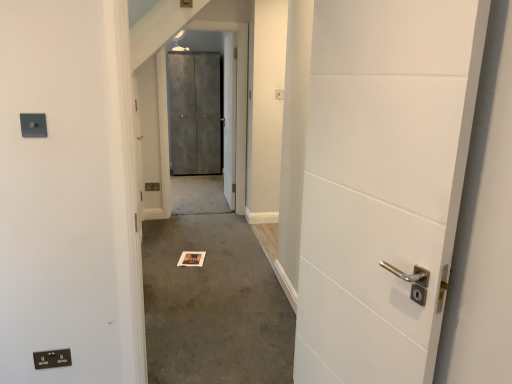
Locate an element on the screen. metallic gray elevator door at center is located at coordinates (234, 131).

At what (x,y) coordinates should I click in order to perform the action: click on matte gray electric outlet at upper left, the 1th electric outlet positioned from the front. Please return your answer as a coordinate pair (x, y). Looking at the image, I should click on point(33,125).

Where is `carpeted floor at center`? carpeted floor at center is located at coordinates (212, 295).

From the image's perspective, which is above, matte gray electric outlet at upper left, arranged as the 2th electric outlet when ordered from the bottom, or black plastic electric outlet at lower left, marked as the 2th electric outlet in a top-to-bottom arrangement?

matte gray electric outlet at upper left, arranged as the 2th electric outlet when ordered from the bottom.

Is matte gray electric outlet at upper left, arranged as the 2th electric outlet when ordered from the bottom, positioned before black plastic electric outlet at lower left, the first electric outlet when ordered from back to front?

Yes, the depth of matte gray electric outlet at upper left, arranged as the 2th electric outlet when ordered from the bottom, is less than that of black plastic electric outlet at lower left, the first electric outlet when ordered from back to front.

What's the angular difference between matte gray electric outlet at upper left, which is the 1th electric outlet from top to bottom, and black plastic electric outlet at lower left, marked as the 1th electric outlet in a bottom-to-top arrangement,'s facing directions?

The facing directions of matte gray electric outlet at upper left, which is the 1th electric outlet from top to bottom, and black plastic electric outlet at lower left, marked as the 1th electric outlet in a bottom-to-top arrangement, are 0.556 degrees apart.

Between carpeted floor at center and black plastic electric outlet at lower left, which ranks as the 2th electric outlet in front-to-back order, which one appears on the left side from the viewer's perspective?

black plastic electric outlet at lower left, which ranks as the 2th electric outlet in front-to-back order, is more to the left.

This screenshot has height=384, width=512. In order to click on electric outlet that is the 2nd object located behind the carpeted floor at center in this screenshot , I will do `click(52, 358)`.

From the image's perspective, which is above, carpeted floor at center or black plastic electric outlet at lower left, marked as the 2th electric outlet in a top-to-bottom arrangement?

From the image's view, carpeted floor at center is above.

Between carpeted floor at center and black plastic electric outlet at lower left, the first electric outlet when ordered from back to front, which one has larger width?

carpeted floor at center is wider.

From a real-world perspective, between black plastic electric outlet at lower left, which ranks as the 2th electric outlet in front-to-back order, and metallic gray elevator door at center, who is vertically lower?

From a 3D spatial view, black plastic electric outlet at lower left, which ranks as the 2th electric outlet in front-to-back order, is below.

Is black plastic electric outlet at lower left, marked as the 1th electric outlet in a bottom-to-top arrangement, inside the boundaries of metallic gray elevator door at center, or outside?

black plastic electric outlet at lower left, marked as the 1th electric outlet in a bottom-to-top arrangement, is not enclosed by metallic gray elevator door at center.

Which of these two, black plastic electric outlet at lower left, marked as the 1th electric outlet in a bottom-to-top arrangement, or metallic gray elevator door at center, stands shorter?

black plastic electric outlet at lower left, marked as the 1th electric outlet in a bottom-to-top arrangement.

Considering the positions of objects black plastic electric outlet at lower left, which ranks as the 2th electric outlet in front-to-back order, and matte gray electric outlet at upper left, arranged as the 2th electric outlet when ordered from the bottom, in the image provided, who is in front, black plastic electric outlet at lower left, which ranks as the 2th electric outlet in front-to-back order, or matte gray electric outlet at upper left, arranged as the 2th electric outlet when ordered from the bottom,?

matte gray electric outlet at upper left, arranged as the 2th electric outlet when ordered from the bottom, is closer to the camera.

Is black plastic electric outlet at lower left, marked as the 2th electric outlet in a top-to-bottom arrangement, to the right of matte gray electric outlet at upper left, the 2th electric outlet in the back-to-front sequence, from the viewer's perspective?

No, black plastic electric outlet at lower left, marked as the 2th electric outlet in a top-to-bottom arrangement, is not to the right of matte gray electric outlet at upper left, the 2th electric outlet in the back-to-front sequence.

Is point (40, 354) positioned after point (32, 114)?

That is True.

Is carpeted floor at center with matte gray electric outlet at upper left, the 1th electric outlet positioned from the front?

No, carpeted floor at center is not touching matte gray electric outlet at upper left, the 1th electric outlet positioned from the front.

Considering the sizes of objects carpeted floor at center and matte gray electric outlet at upper left, arranged as the 2th electric outlet when ordered from the bottom, in the image provided, who is smaller, carpeted floor at center or matte gray electric outlet at upper left, arranged as the 2th electric outlet when ordered from the bottom,?

matte gray electric outlet at upper left, arranged as the 2th electric outlet when ordered from the bottom, is smaller.

Considering the relative sizes of carpeted floor at center and matte gray electric outlet at upper left, the 1th electric outlet positioned from the front, in the image provided, is carpeted floor at center taller than matte gray electric outlet at upper left, the 1th electric outlet positioned from the front,?

Yes.

Looking at their sizes, would you say metallic gray elevator door at center is wider or thinner than carpeted floor at center?

metallic gray elevator door at center is wider than carpeted floor at center.

What's the angular difference between metallic gray elevator door at center and carpeted floor at center's facing directions?

They differ by 0.634 degrees in their facing directions.

Which is in front, metallic gray elevator door at center or carpeted floor at center?

carpeted floor at center.

There is a carpeted floor at center. At what (x,y) coordinates should I click in order to perform the action: click on elevator door above it (from a real-world perspective). Please return your answer as a coordinate pair (x, y). This screenshot has width=512, height=384. Looking at the image, I should click on (234, 131).

Does point (35, 357) lie behind point (154, 371)?

No, it is in front of (154, 371).

Is black plastic electric outlet at lower left, the first electric outlet when ordered from back to front, aimed at carpeted floor at center?

No, black plastic electric outlet at lower left, the first electric outlet when ordered from back to front, does not turn towards carpeted floor at center.

Considering the positions of objects black plastic electric outlet at lower left, marked as the 1th electric outlet in a bottom-to-top arrangement, and carpeted floor at center in the image provided, who is more to the left, black plastic electric outlet at lower left, marked as the 1th electric outlet in a bottom-to-top arrangement, or carpeted floor at center?

From the viewer's perspective, black plastic electric outlet at lower left, marked as the 1th electric outlet in a bottom-to-top arrangement, appears more on the left side.

You are a GUI agent. You are given a task and a screenshot of the screen. Output one action in this format:
    pyautogui.click(x=<x>, y=<y>)
    Task: Click on the electric outlet in front of the black plastic electric outlet at lower left, marked as the 2th electric outlet in a top-to-bottom arrangement
    Image resolution: width=512 pixels, height=384 pixels.
    Given the screenshot: What is the action you would take?
    pyautogui.click(x=33, y=125)

Find the location of `electric outlet that is the 2nd object located behind the carpeted floor at center`. electric outlet that is the 2nd object located behind the carpeted floor at center is located at coordinates (52, 358).

Estimate the real-world distances between objects in this image. Which object is further from black plastic electric outlet at lower left, marked as the 1th electric outlet in a bottom-to-top arrangement, metallic gray elevator door at center or matte gray electric outlet at upper left, the 2th electric outlet in the back-to-front sequence?

The object further to black plastic electric outlet at lower left, marked as the 1th electric outlet in a bottom-to-top arrangement, is metallic gray elevator door at center.

Based on their spatial positions, is matte gray electric outlet at upper left, which is the 1th electric outlet from top to bottom, or carpeted floor at center further from metallic gray elevator door at center?

Among the two, matte gray electric outlet at upper left, which is the 1th electric outlet from top to bottom, is located further to metallic gray elevator door at center.

Estimate the real-world distances between objects in this image. Which object is closer to metallic gray elevator door at center, carpeted floor at center or matte gray electric outlet at upper left, the 2th electric outlet in the back-to-front sequence?

carpeted floor at center is closer to metallic gray elevator door at center.

From the image, which object appears to be nearer to black plastic electric outlet at lower left, the first electric outlet when ordered from back to front, metallic gray elevator door at center or carpeted floor at center?

carpeted floor at center lies closer to black plastic electric outlet at lower left, the first electric outlet when ordered from back to front, than the other object.

In the scene shown: From the image, which object appears to be nearer to carpeted floor at center, black plastic electric outlet at lower left, which ranks as the 2th electric outlet in front-to-back order, or matte gray electric outlet at upper left, the 2th electric outlet in the back-to-front sequence?

Among the two, black plastic electric outlet at lower left, which ranks as the 2th electric outlet in front-to-back order, is located nearer to carpeted floor at center.

From the image, which object appears to be farther from matte gray electric outlet at upper left, the 2th electric outlet in the back-to-front sequence, black plastic electric outlet at lower left, the first electric outlet when ordered from back to front, or carpeted floor at center?

carpeted floor at center.

When comparing their distances from black plastic electric outlet at lower left, marked as the 2th electric outlet in a top-to-bottom arrangement, does matte gray electric outlet at upper left, which is the 1th electric outlet from top to bottom, or carpeted floor at center seem further?

The object further to black plastic electric outlet at lower left, marked as the 2th electric outlet in a top-to-bottom arrangement, is carpeted floor at center.

Considering their positions, is matte gray electric outlet at upper left, which is the 1th electric outlet from top to bottom, positioned further to black plastic electric outlet at lower left, which ranks as the 2th electric outlet in front-to-back order, than metallic gray elevator door at center?

metallic gray elevator door at center lies further to black plastic electric outlet at lower left, which ranks as the 2th electric outlet in front-to-back order, than the other object.

Locate an element on the screen. This screenshot has height=384, width=512. electric outlet between matte gray electric outlet at upper left, arranged as the 2th electric outlet when ordered from the bottom, and metallic gray elevator door at center, along the z-axis is located at coordinates (52, 358).

Find the location of a particular element. This screenshot has height=384, width=512. corridor between matte gray electric outlet at upper left, the 2th electric outlet in the back-to-front sequence, and black plastic electric outlet at lower left, the first electric outlet when ordered from back to front, in the up-down direction is located at coordinates (212, 295).